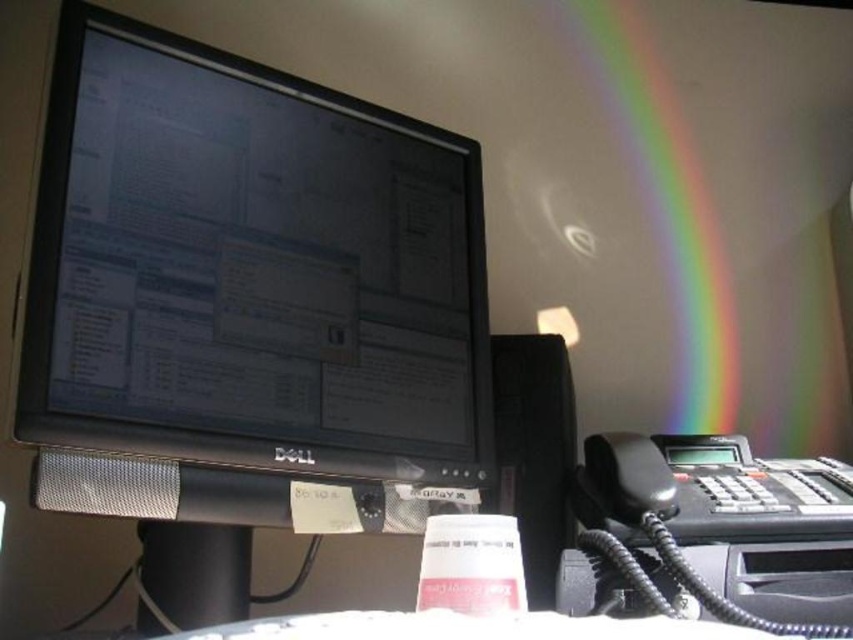
Measure the distance between black matte monitor at center and rainbow translucent at upper right.

26.48 inches

Who is more distant from viewer, (223,163) or (670,227)?

The point (670,227) is more distant.

Between point (41, 330) and point (579, 10), which one is positioned behind?

Positioned behind is point (579, 10).

Locate an element on the screen. Image resolution: width=853 pixels, height=640 pixels. black matte monitor at center is located at coordinates (248, 269).